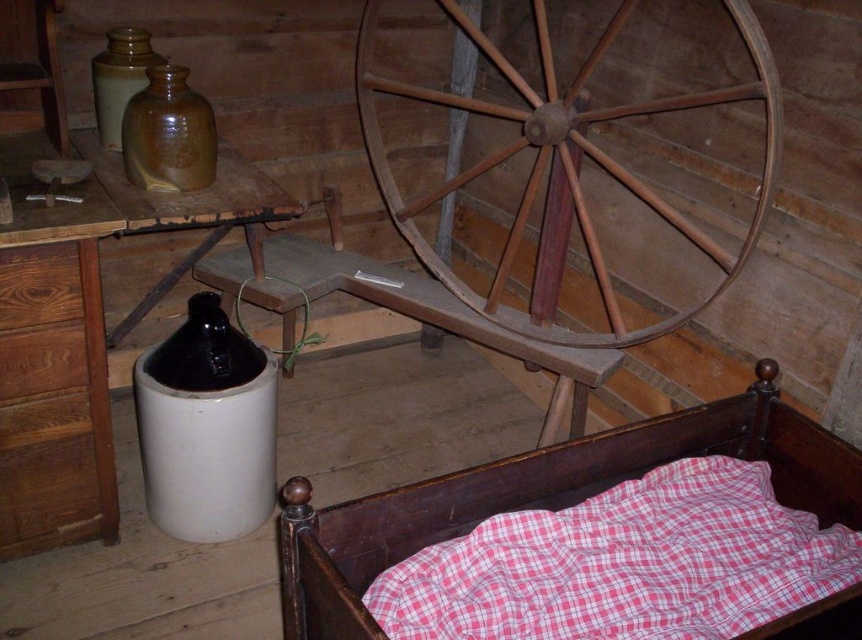
Question: Which point is closer to the camera taking this photo?

Choices:
 (A) (94, 86)
 (B) (141, 164)
 (C) (806, 422)

Answer: (C)

Question: Among these points, which one is nearest to the camera?

Choices:
 (A) (836, 476)
 (B) (133, 74)

Answer: (A)

Question: Does wooden wagon wheel at center have a larger size compared to brown matte bottle at upper left?

Choices:
 (A) yes
 (B) no

Answer: (A)

Question: Does wooden bed frame at lower right have a larger size compared to brown matte bottle at upper left?

Choices:
 (A) yes
 (B) no

Answer: (A)

Question: Does wooden bed frame at lower right have a lesser width compared to wooden wagon wheel at center?

Choices:
 (A) no
 (B) yes

Answer: (A)

Question: Estimate the real-world distances between objects in this image. Which object is farther from the wooden wagon wheel at center?

Choices:
 (A) wooden bed frame at lower right
 (B) brown matte bottle at upper left
 (C) matte brown jug at upper left

Answer: (C)